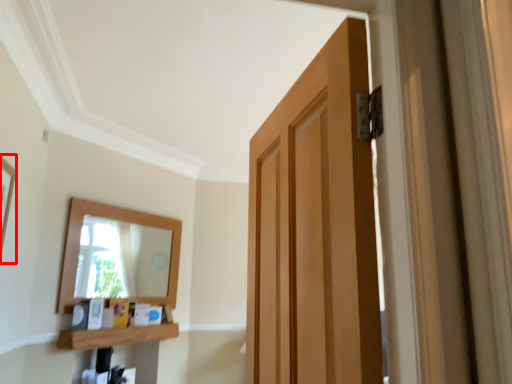
Question: From the image's perspective, where is picture frame (annotated by the red box) located relative to shelf?

Choices:
 (A) above
 (B) below

Answer: (A)